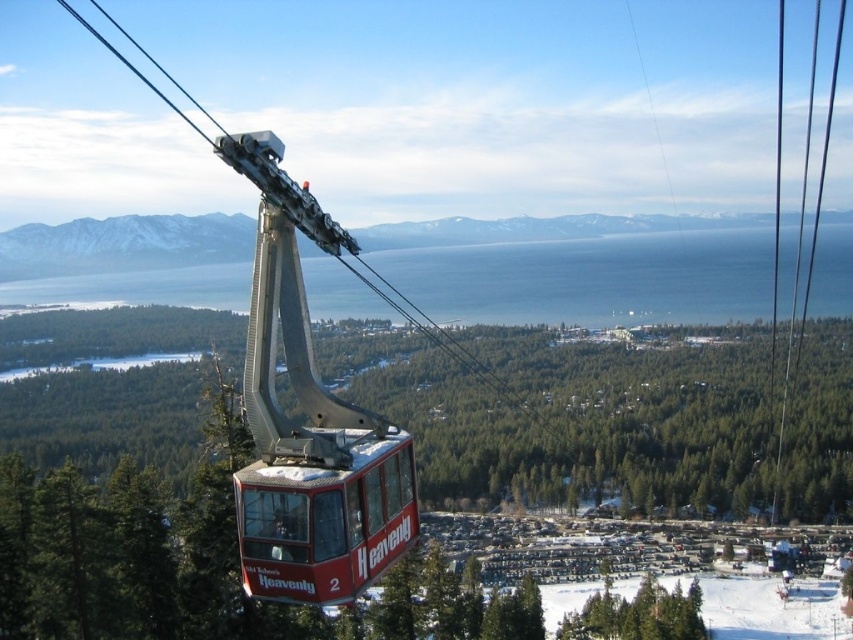
Does point (302, 477) lie behind point (741, 604)?

No, (302, 477) is closer to viewer.

Measure the distance between red glossy cable car at center and camera.

red glossy cable car at center and camera are 104.28 feet apart from each other.

You are a GUI agent. You are given a task and a screenshot of the screen. Output one action in this format:
    pyautogui.click(x=<x>, y=<y>)
    Task: Click on the red glossy cable car at center
    This screenshot has height=640, width=853.
    Given the screenshot: What is the action you would take?
    [x=326, y=518]